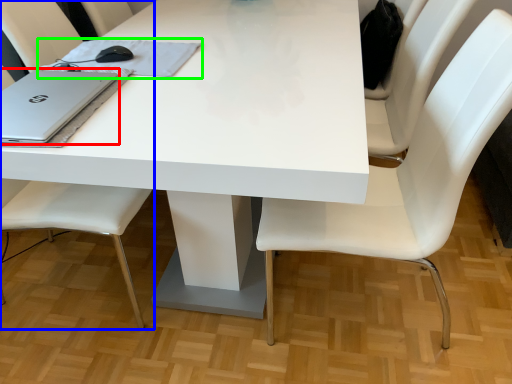
Question: Which is farther away from laptop (highlighted by a red box)? chair (highlighted by a blue box) or notebook (highlighted by a green box)?

Choices:
 (A) chair
 (B) notebook

Answer: (A)